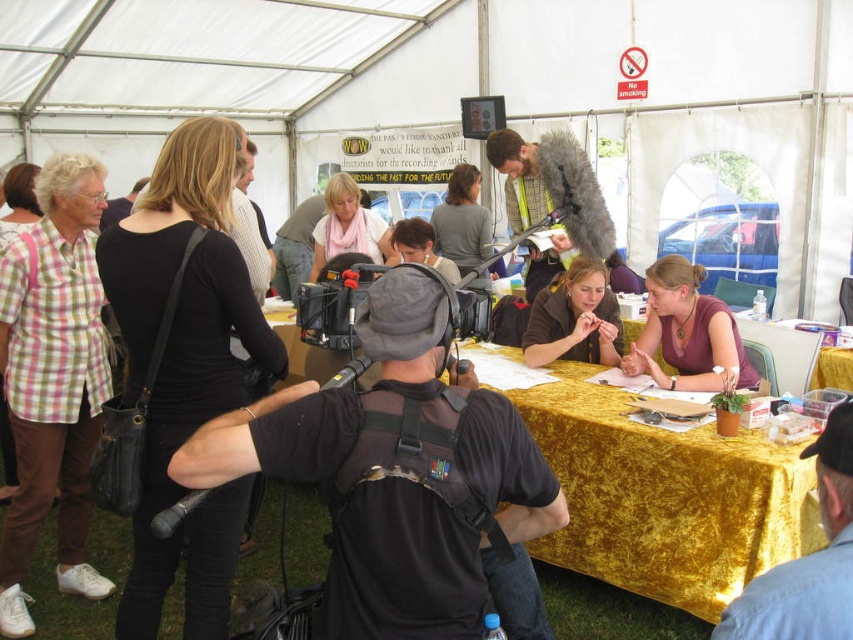
Who is taller, gold velvet table at center or pink scarf at center?

Standing taller between the two is gold velvet table at center.

Does gold velvet table at center have a lesser width compared to pink scarf at center?

No, gold velvet table at center is not thinner than pink scarf at center.

Is point (625, 456) positioned after point (384, 260)?

No.

Where is `gold velvet table at center`? Image resolution: width=853 pixels, height=640 pixels. gold velvet table at center is located at coordinates (665, 496).

Can you confirm if purple fabric at center is taller than matte gray microphone at center?

In fact, purple fabric at center may be shorter than matte gray microphone at center.

Between point (663, 381) and point (450, 243), which one is positioned behind?

The point (450, 243) is behind.

Which is behind, point (660, 340) or point (431, 224)?

Point (431, 224)

Find the location of a particular element. purple fabric at center is located at coordinates (688, 333).

Can you confirm if pink scarf at center is positioned to the left of matte gray microphone at center?

Yes, pink scarf at center is to the left of matte gray microphone at center.

Which is below, pink scarf at center or matte gray microphone at center?

pink scarf at center is lower down.

The image size is (853, 640). Find the location of `pink scarf at center`. pink scarf at center is located at coordinates (347, 227).

Find the location of a particular element. The height and width of the screenshot is (640, 853). pink scarf at center is located at coordinates (347, 227).